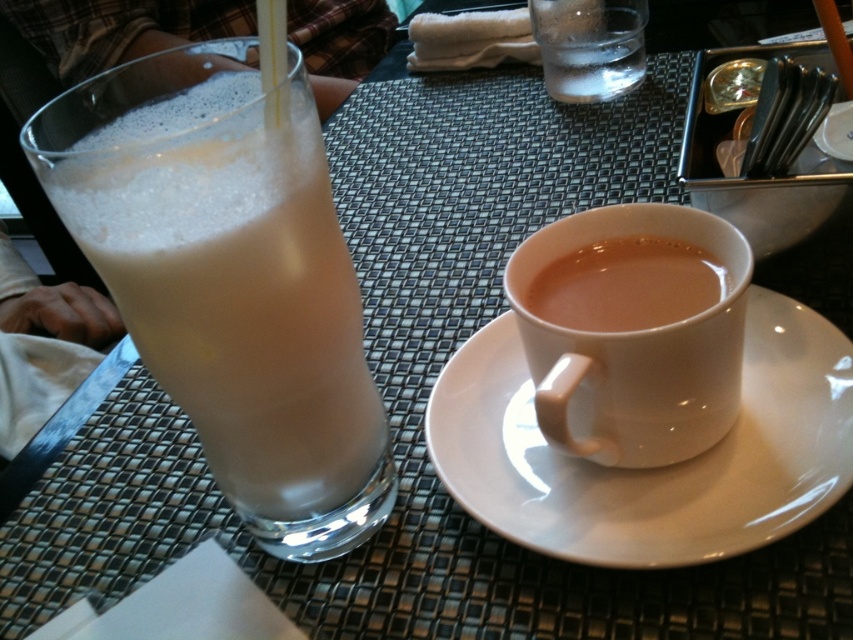
Is white ceramic saucer at center bigger than brown matte cup at center?

Yes.

Which is behind, point (746, 486) or point (576, 280)?

The point (576, 280) is behind.

The image size is (853, 640). Find the location of `white ceramic saucer at center`. white ceramic saucer at center is located at coordinates (653, 468).

Which is behind, point (755, 342) or point (573, 32)?

Point (573, 32)

Which is more to the right, white ceramic saucer at center or clear glass at upper center?

From the viewer's perspective, clear glass at upper center appears more on the right side.

Identify the location of white ceramic saucer at center. (653, 468).

Locate an element on the screen. This screenshot has width=853, height=640. white ceramic saucer at center is located at coordinates (653, 468).

Is point (556, 323) farther from viewer compared to point (561, 38)?

No, it is in front of (561, 38).

Identify the location of brown matte cup at center. (625, 284).